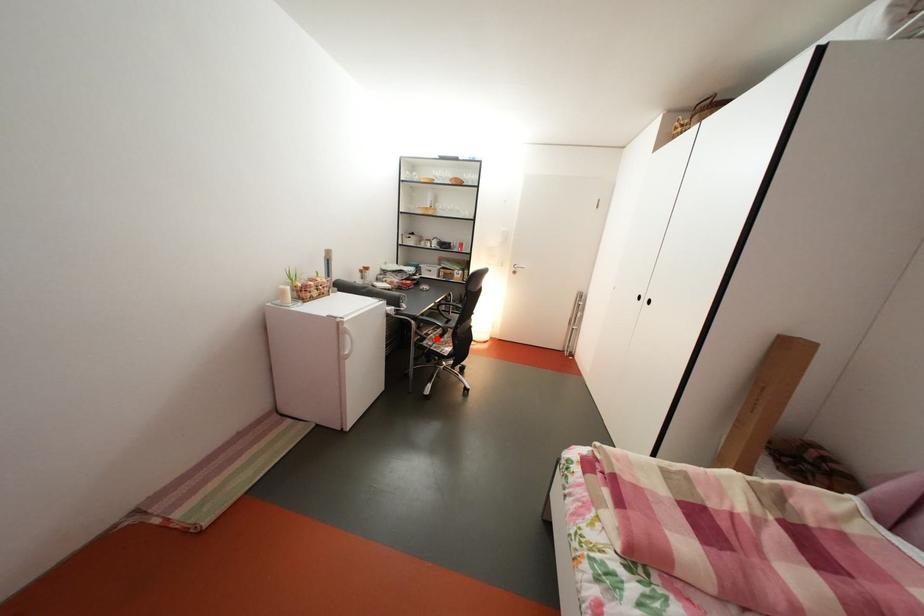
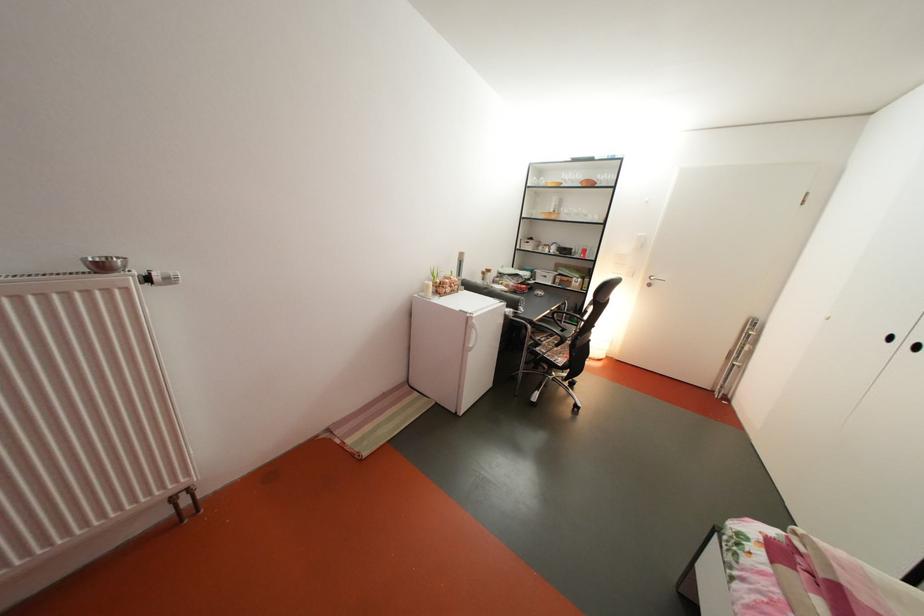
Find the pixel in the second image that matches the highlighted location in the first image.

(550, 344)